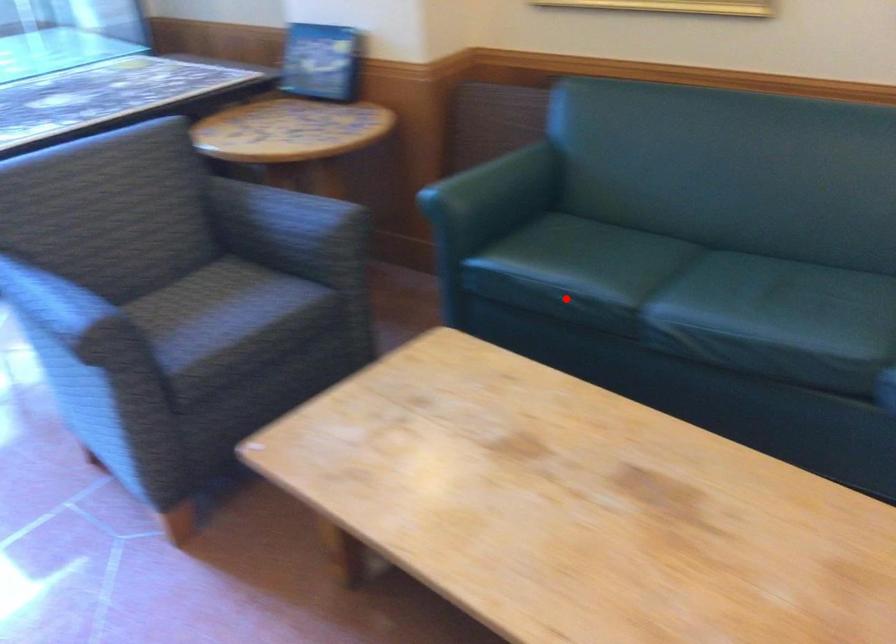
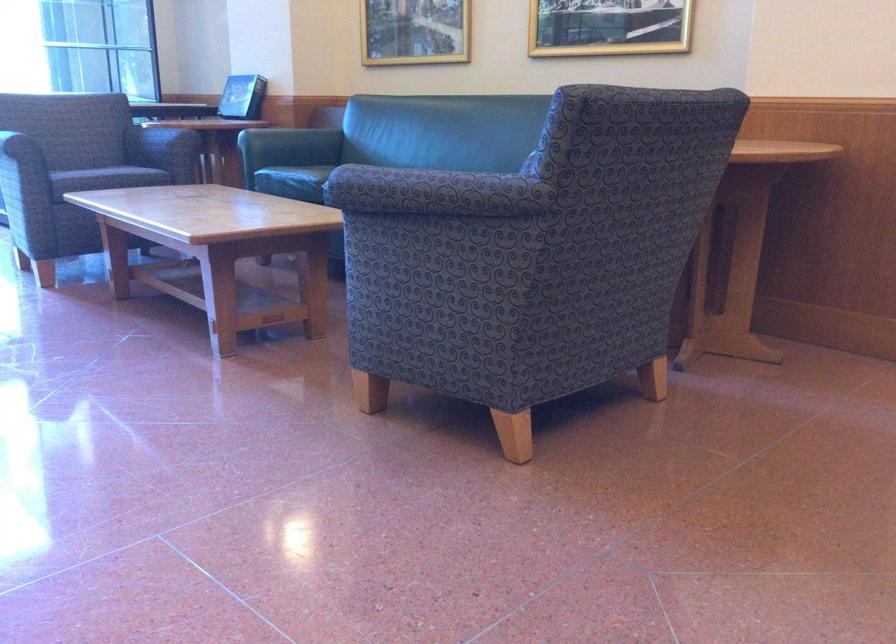
Find the pixel in the second image that matches the highlighted location in the first image.

(293, 182)